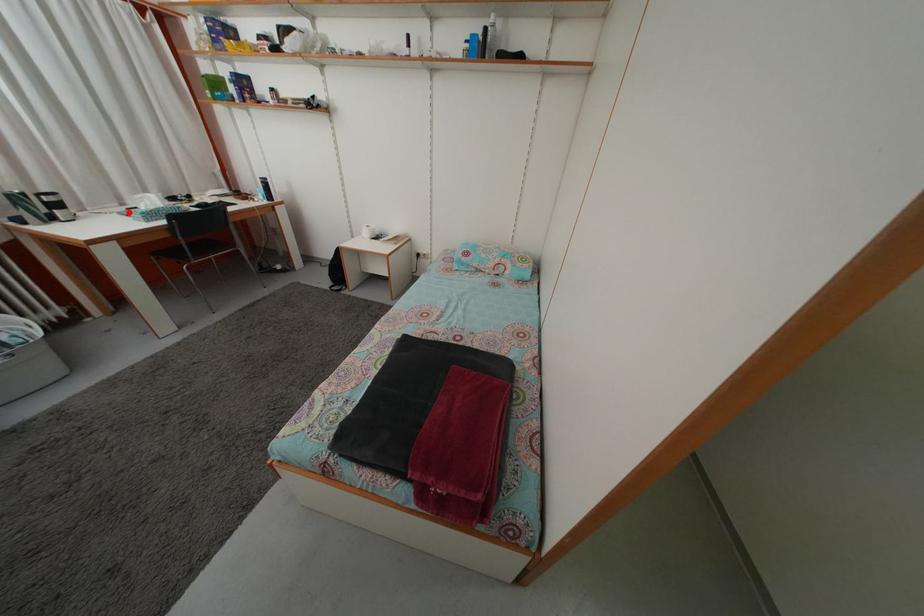
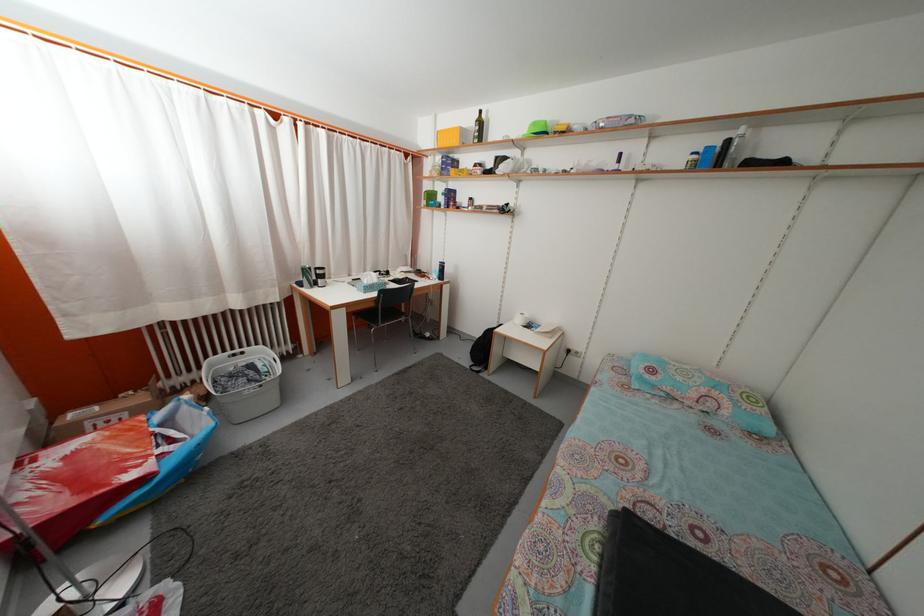
Locate, in the second image, the point that corresponds to the highlighted location in the first image.

(355, 283)